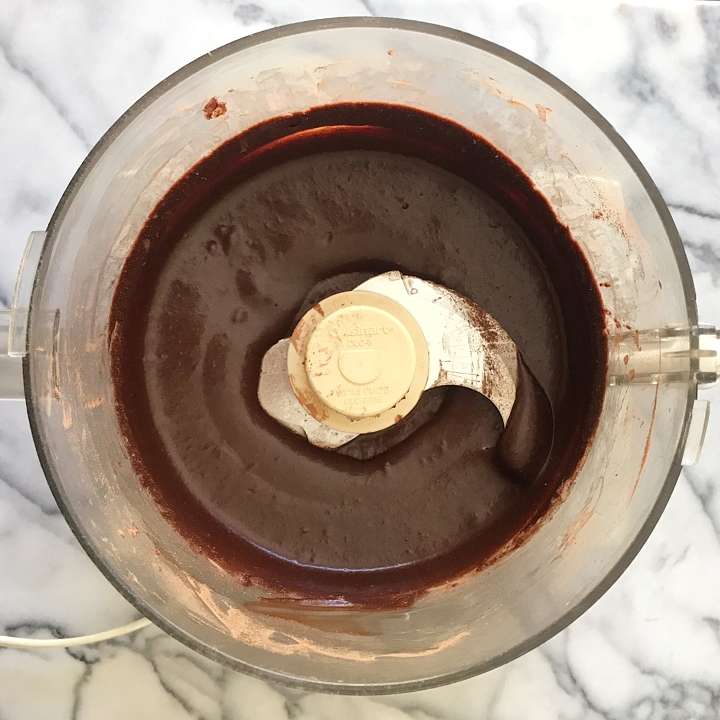
Where is `counter`? Image resolution: width=720 pixels, height=720 pixels. counter is located at coordinates (584, 664).